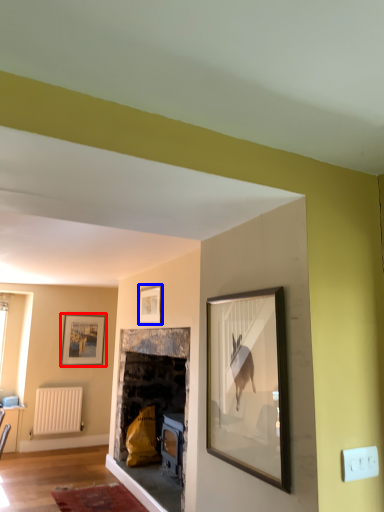
Question: Which object appears closest to the camera in this image, picture frame (highlighted by a red box) or picture frame (highlighted by a blue box)?

Choices:
 (A) picture frame
 (B) picture frame

Answer: (B)